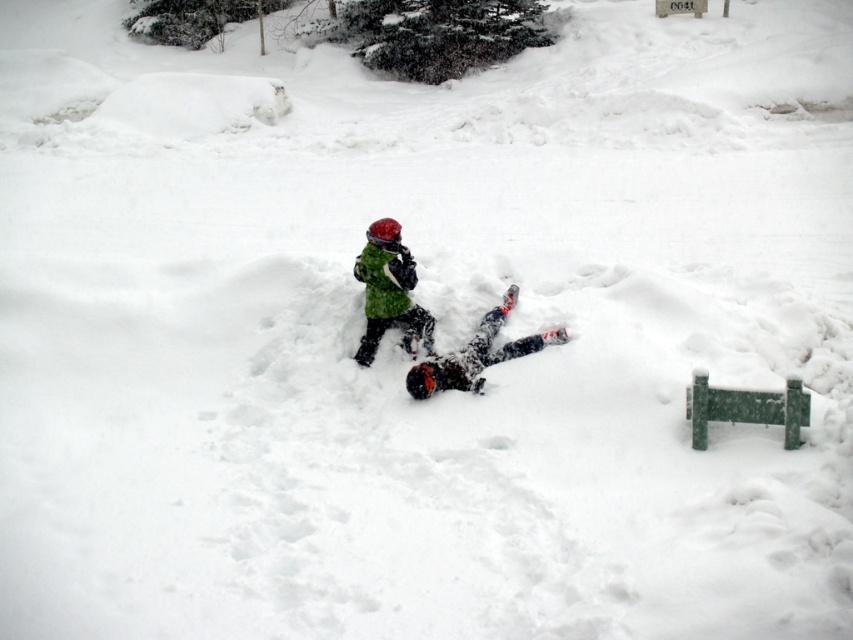
Question: Based on their relative distances, which object is nearer to the dark gray fabric snowboarder at center?

Choices:
 (A) green fuzzy jacket at center
 (B) green snowsuit at center

Answer: (B)

Question: Considering the real-world distances, which object is closest to the dark gray fabric snowboarder at center?

Choices:
 (A) green snowsuit at center
 (B) green fuzzy jacket at center

Answer: (A)

Question: Where is dark gray fabric snowboarder at center located in relation to green fuzzy jacket at center in the image?

Choices:
 (A) right
 (B) left

Answer: (A)

Question: Which point is closer to the camera taking this photo?

Choices:
 (A) (384, 307)
 (B) (404, 301)

Answer: (A)

Question: Does green snowsuit at center have a larger size compared to dark gray fabric snowboarder at center?

Choices:
 (A) yes
 (B) no

Answer: (B)

Question: Does green snowsuit at center have a larger size compared to green fuzzy jacket at center?

Choices:
 (A) no
 (B) yes

Answer: (B)